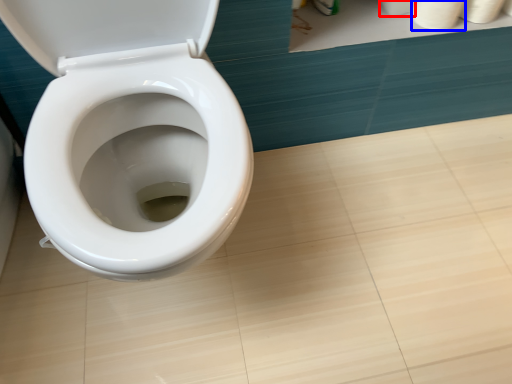
Question: Which point is closer to the camera, toilet paper (highlighted by a red box) or toilet paper (highlighted by a blue box)?

Choices:
 (A) toilet paper
 (B) toilet paper

Answer: (B)